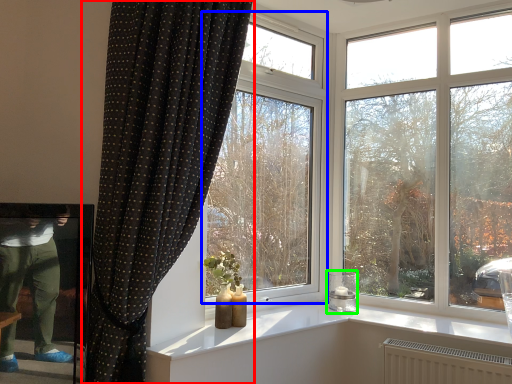
Question: Which object is the farthest from curtain (highlighted by a red box)? Choose among these: window (highlighted by a blue box) or candle holder (highlighted by a green box).

Choices:
 (A) window
 (B) candle holder

Answer: (B)